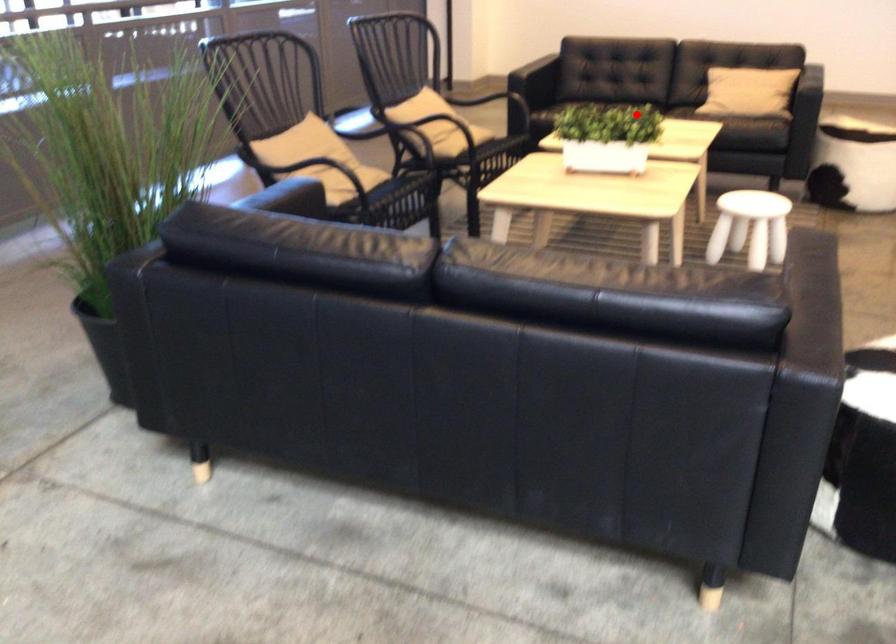
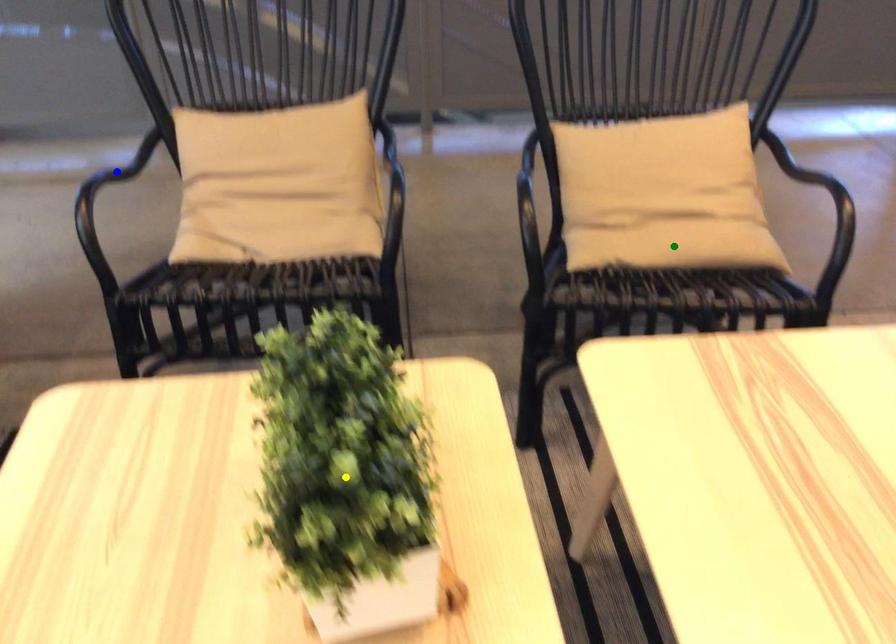
Question: I am providing you with two images of the same scene from different viewpoints. A red point is marked on the first image. You are given multiple points on the second image. Can you choose the point in image 2 that corresponds to the point in image 1?

Choices:
 (A) blue point
 (B) yellow point
 (C) green point

Answer: (B)